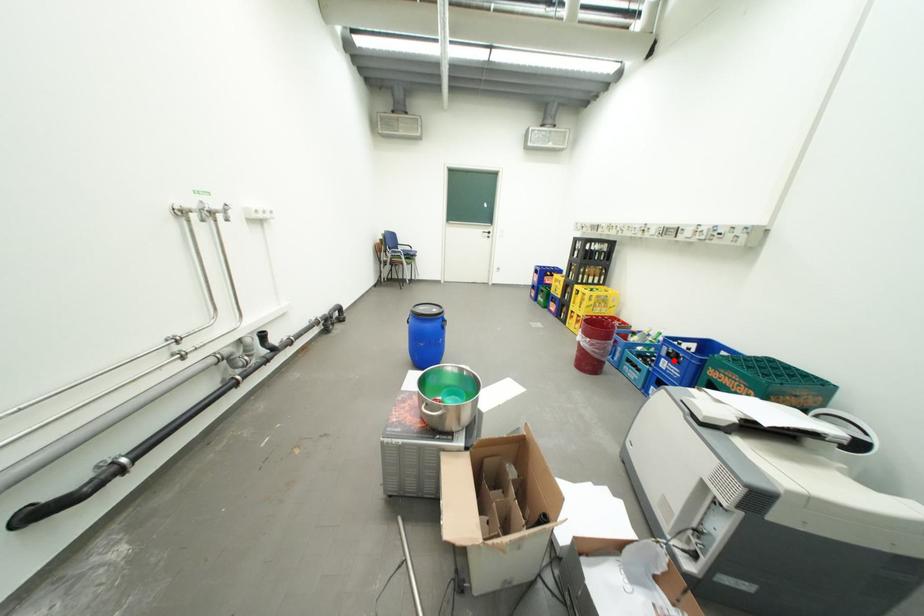
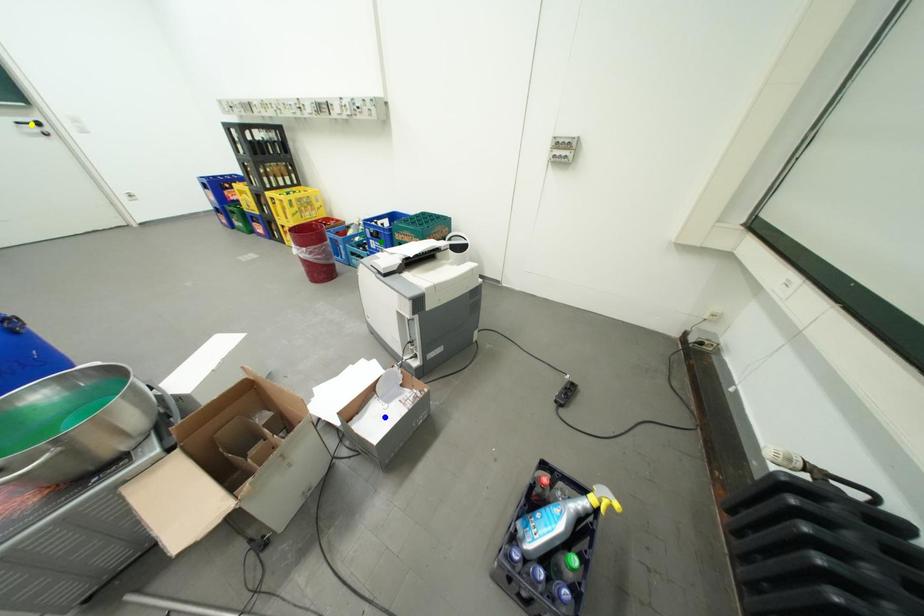
Question: I am providing you with two images of the same scene from different viewpoints. A red point is marked on the first image. You are given multiple points on the second image. Which mark in image 2 goes with the point in image 1?

Choices:
 (A) yellow point
 (B) green point
 (C) blue point

Answer: (B)